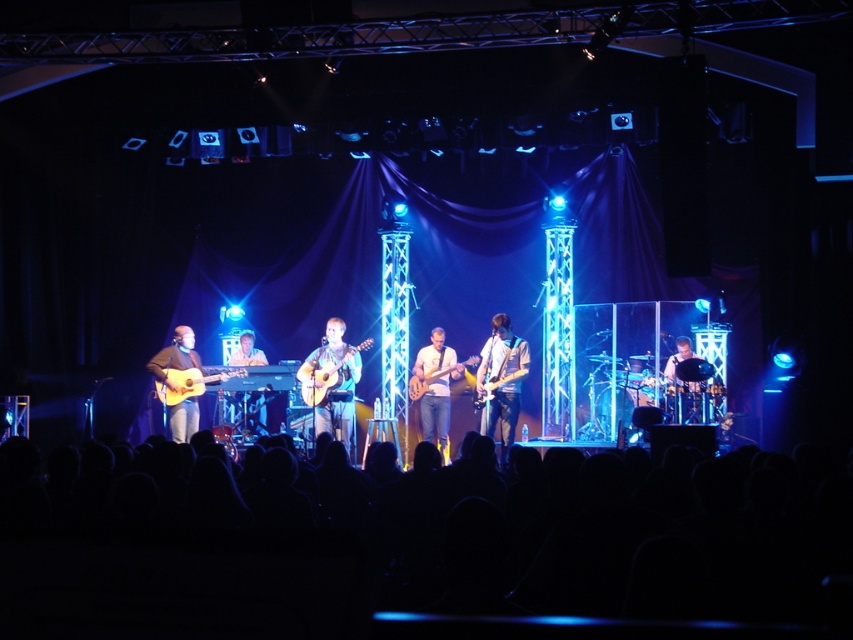
Does point (352, 384) come in front of point (316, 396)?

No, it is not.

Who is lower down, matte brown acoustic guitar at center or wooden acoustic guitar at center?

matte brown acoustic guitar at center is below.

Between point (297, 376) and point (320, 380), which one is positioned behind?

The point (320, 380) is more distant.

At what (x,y) coordinates should I click in order to perform the action: click on matte brown acoustic guitar at center. Please return your answer as a coordinate pair (x, y). This screenshot has width=853, height=640. Looking at the image, I should click on (335, 385).

Is black fabric crowd at lower center smaller than shiny silver guitar at center?

Yes.

Is black fabric crowd at lower center below shiny silver guitar at center?

Correct, black fabric crowd at lower center is located below shiny silver guitar at center.

Is point (386, 612) farther from viewer compared to point (500, 396)?

No.

Where is `black fabric crowd at lower center`? The image size is (853, 640). black fabric crowd at lower center is located at coordinates (418, 544).

Image resolution: width=853 pixels, height=640 pixels. What do you see at coordinates (436, 388) in the screenshot? I see `light brown wood guitar at center` at bounding box center [436, 388].

Between light brown wood guitar at center and wooden acoustic guitar at center, which one is positioned lower?

light brown wood guitar at center is below.

What do you see at coordinates (436, 388) in the screenshot?
I see `light brown wood guitar at center` at bounding box center [436, 388].

What are the coordinates of `light brown wood guitar at center` in the screenshot? It's located at (436, 388).